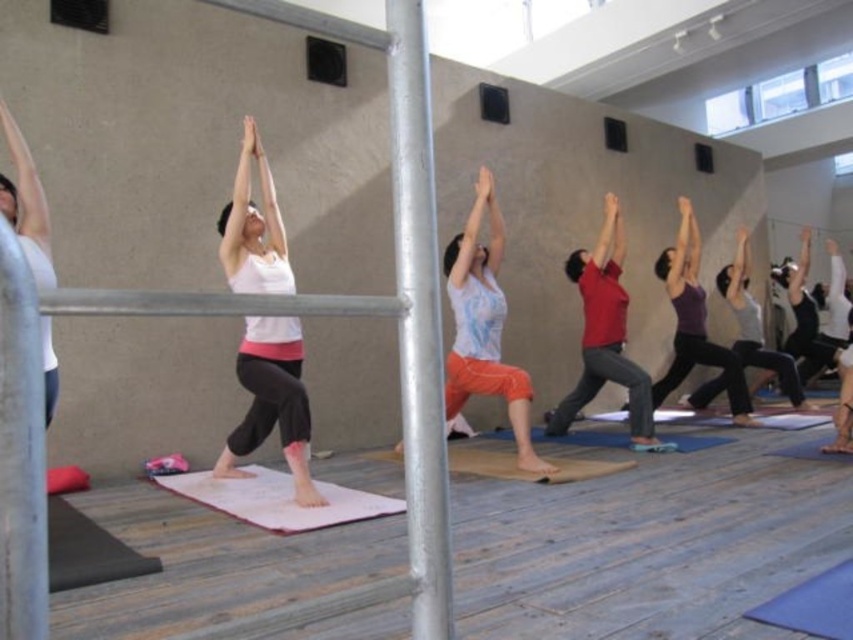
Consider the image. Does purple matte leggings at center have a lesser height compared to brown textured yoga mat at center?

Incorrect, purple matte leggings at center's height does not fall short of brown textured yoga mat at center's.

Can you confirm if purple matte leggings at center is smaller than brown textured yoga mat at center?

Actually, purple matte leggings at center might be larger than brown textured yoga mat at center.

Does point (741, 324) come behind point (523, 476)?

Yes, point (741, 324) is farther from viewer.

Find the location of a particular element. purple matte leggings at center is located at coordinates (x=755, y=326).

Is point (283, 326) positioned behind point (737, 320)?

No, it is in front of (737, 320).

Can you confirm if matte white tank top at center is smaller than purple matte leggings at center?

Indeed, matte white tank top at center has a smaller size compared to purple matte leggings at center.

You are a GUI agent. You are given a task and a screenshot of the screen. Output one action in this format:
    pyautogui.click(x=<x>, y=<y>)
    Task: Click on the matte white tank top at center
    The height and width of the screenshot is (640, 853).
    Given the screenshot: What is the action you would take?
    pyautogui.click(x=271, y=403)

This screenshot has height=640, width=853. Find the location of `matte white tank top at center`. matte white tank top at center is located at coordinates (271, 403).

Consider the image. Who is more distant from viewer, (283, 476) or (747, 406)?

Point (747, 406)

Is point (254, 477) in front of point (685, 209)?

Yes, point (254, 477) is in front of point (685, 209).

The width and height of the screenshot is (853, 640). Identify the location of pink fabric yoga mat at center. (277, 499).